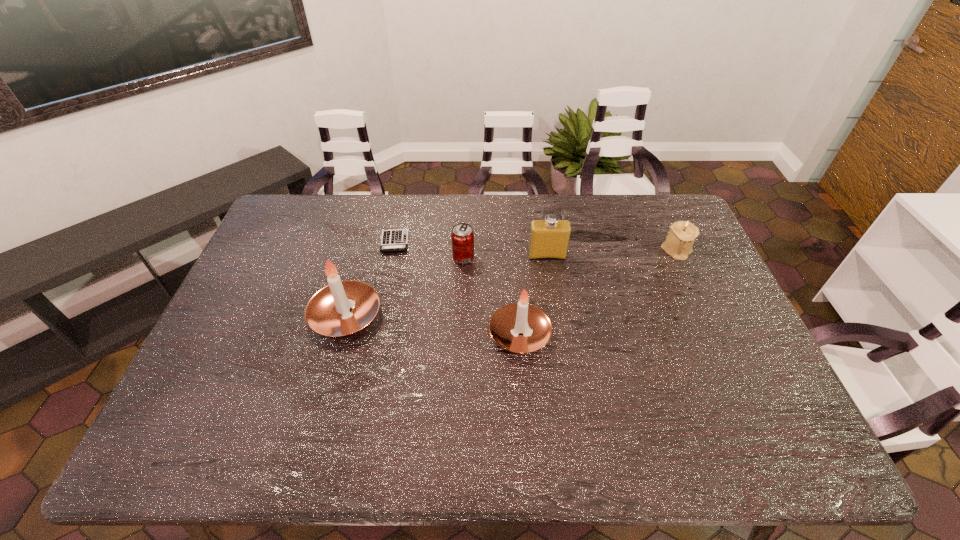
In order to click on free space located on the front-facing side of the perfume in this screenshot , I will do `click(559, 335)`.

The image size is (960, 540). In order to click on vacant space situated 0.390m on the front of the candle_holder in this screenshot , I will do `click(729, 363)`.

Image resolution: width=960 pixels, height=540 pixels. In order to click on vacant space positioned 0.280m on the back of the pop soda in this screenshot , I will do `click(466, 200)`.

Identify the location of object located in the far edge section of the desktop. This screenshot has height=540, width=960. (392, 240).

Locate an element on the screen. The width and height of the screenshot is (960, 540). object at the right edge is located at coordinates (679, 241).

The image size is (960, 540). In the image, there is a desktop. In order to click on free space at the far edge in this screenshot , I will do `click(521, 208)`.

In the image, there is a desktop. Identify the location of vacant space at the near edge. Image resolution: width=960 pixels, height=540 pixels. (703, 415).

What are the coordinates of `free space at the right edge` in the screenshot? It's located at (741, 343).

What are the coordinates of `vacant space at the near right corner of the desktop` in the screenshot? It's located at (745, 393).

At what (x,y) coordinates should I click in order to perform the action: click on unoccupied position between the fourth object from right to left and the calculator. Please return your answer as a coordinate pair (x, y). The image size is (960, 540). Looking at the image, I should click on (429, 250).